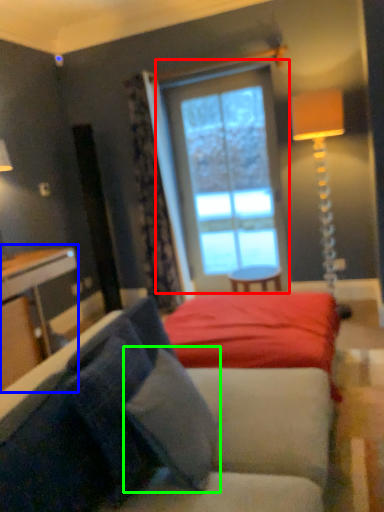
Question: Which object is positioned closest to window (highlighted by a red box)? Select from table (highlighted by a blue box) and pillow (highlighted by a green box).

Choices:
 (A) table
 (B) pillow

Answer: (A)